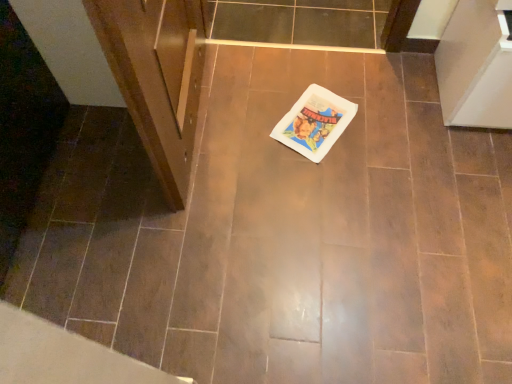
Where is `white glossy cabinet at right`? Image resolution: width=512 pixels, height=384 pixels. white glossy cabinet at right is located at coordinates (476, 66).

What is the approximate height of white glossy cabinet at right?

18.59 inches.

This screenshot has height=384, width=512. What do you see at coordinates (476, 66) in the screenshot? I see `white glossy cabinet at right` at bounding box center [476, 66].

Identify the location of white glossy cabinet at right. (476, 66).